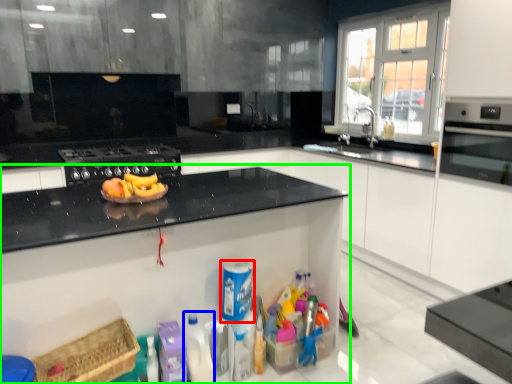
Question: Which is farther away from cleaning product (highlighted by a red box)? cleaning product (highlighted by a blue box) or cabinetry (highlighted by a green box)?

Choices:
 (A) cleaning product
 (B) cabinetry

Answer: (B)